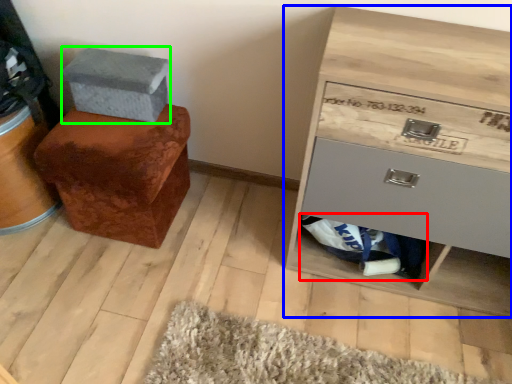
Question: Which is farther away from material (highlighted by a red box)? chest of drawers (highlighted by a blue box) or shoe box (highlighted by a green box)?

Choices:
 (A) chest of drawers
 (B) shoe box

Answer: (B)